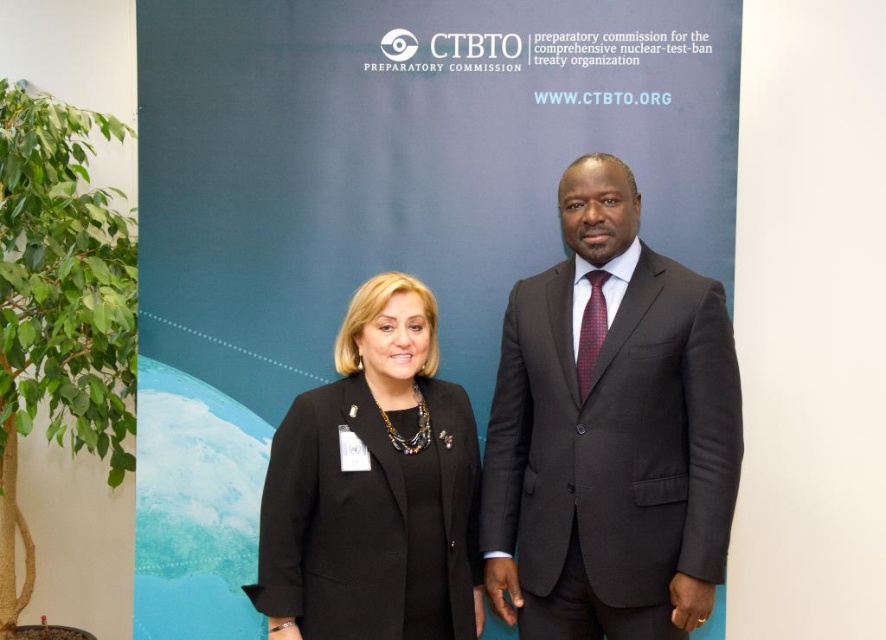
You are attending an international conference and need to choose between two outfits displayed in the image. The dark gray suit at center and the black fabric jacket at center. Which outfit has a wider silhouette?

The dark gray suit at center has a wider silhouette than the black fabric jacket at center, as its width surpasses the latter.

You are a photographer setting up for a group photo. You need to ensure that the dark gray suit at center and the black fabric jacket at center are clearly visible in the frame. Given that your camera has a depth of field that can sharply focus on objects within a 30 cm range, will both items remain in focus?

The dark gray suit at center is 32.75 centimeters away from the black fabric jacket at center. Since the distance between them exceeds the camera lens depth of field range of 30 cm, only one of the items will be in sharp focus while the other may appear slightly blurred.

You are standing in front of a CTBTO event and see two points marked on the floor. The first point is at coordinates point (371, 272) and the second point is at point (438, 432). If you want to approach the person who is closer to you, which point should you walk towards?

Point (371, 272) is further to the viewer than point (438, 432). Therefore, you should walk towards point (371, 272) to approach the person who is closer to you.